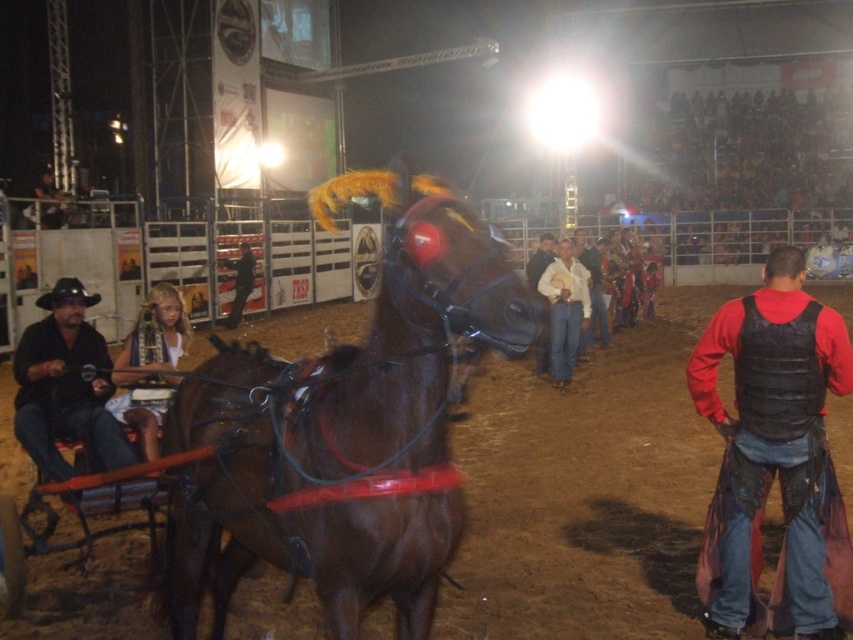
Question: Which of the following is the farthest from the observer?

Choices:
 (A) red leather vest at right
 (B) brown glossy horse at center
 (C) matte black cowboy hat at left

Answer: (C)

Question: Can you confirm if brown glossy horse at center is bigger than matte black cowboy hat at left?

Choices:
 (A) no
 (B) yes

Answer: (B)

Question: Among these points, which one is nearest to the camera?

Choices:
 (A) (775, 276)
 (B) (279, 525)
 (C) (53, 285)
 (D) (160, 353)

Answer: (B)

Question: Can you confirm if red leather vest at right is positioned to the left of white fabric headband at left?

Choices:
 (A) no
 (B) yes

Answer: (A)

Question: Which is nearer to the white fabric headband at left?

Choices:
 (A) red leather vest at right
 (B) matte black cowboy hat at left
 (C) brown glossy horse at center

Answer: (B)

Question: From the image, what is the correct spatial relationship of matte black cowboy hat at left in relation to white fabric headband at left?

Choices:
 (A) below
 (B) above

Answer: (B)